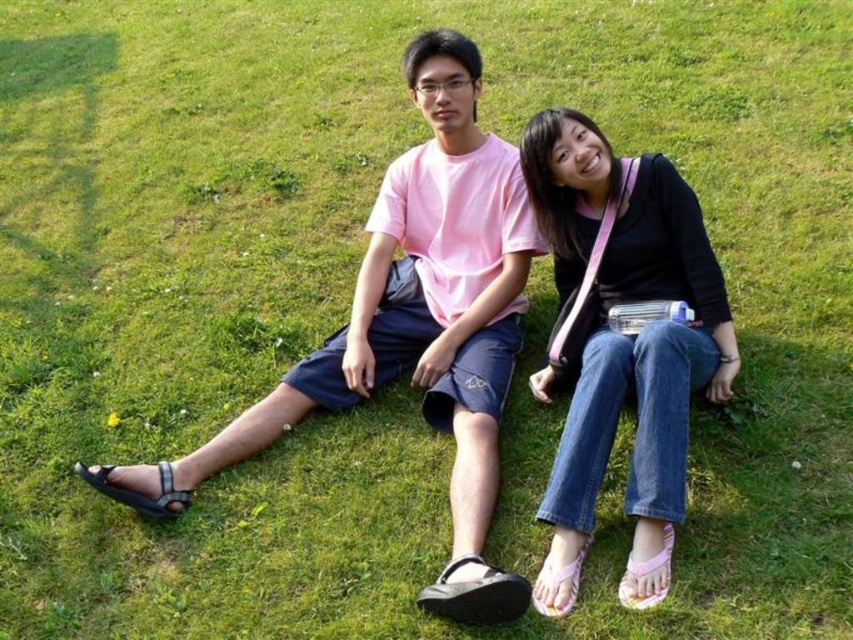
Is denim jeans at center taller than black rubber sandal at lower center?

Yes, denim jeans at center is taller than black rubber sandal at lower center.

Looking at this image, who is more distant from viewer, (646, 240) or (467, 586)?

Point (646, 240)

Locate an element on the screen. The image size is (853, 640). denim jeans at center is located at coordinates (625, 317).

Does denim jeans at center appear under pink fabric sandal at lower center?

No.

Is denim jeans at center to the right of pink fabric sandal at lower center from the viewer's perspective?

Correct, you'll find denim jeans at center to the right of pink fabric sandal at lower center.

In order to click on denim jeans at center in this screenshot , I will do `click(625, 317)`.

Between black rubber sandal at lower center and pink fabric sandal at lower right, which one is positioned higher?

Positioned higher is pink fabric sandal at lower right.

Can you confirm if black rubber sandal at lower center is smaller than pink fabric sandal at lower right?

Actually, black rubber sandal at lower center might be larger than pink fabric sandal at lower right.

The width and height of the screenshot is (853, 640). What are the coordinates of `black rubber sandal at lower center` in the screenshot? It's located at (476, 595).

Identify the location of black rubber sandal at lower center. The image size is (853, 640). (476, 595).